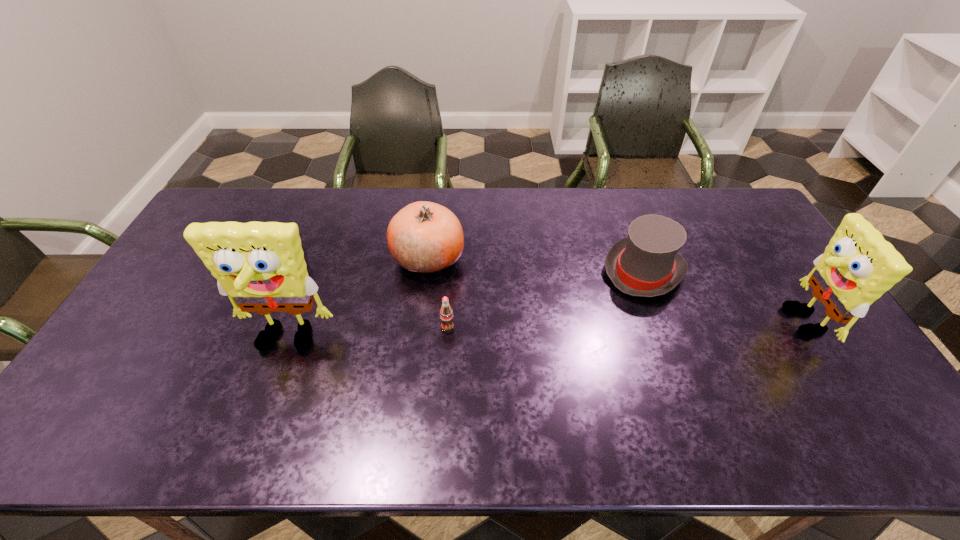
Image resolution: width=960 pixels, height=540 pixels. I want to click on the taller sponge, so click(260, 266).

You are a GUI agent. You are given a task and a screenshot of the screen. Output one action in this format:
    pyautogui.click(x=<x>, y=<y>)
    Task: Click on the left sponge
    
    Given the screenshot: What is the action you would take?
    pyautogui.click(x=260, y=266)

You are a GUI agent. You are given a task and a screenshot of the screen. Output one action in this format:
    pyautogui.click(x=<x>, y=<y>)
    Task: Click on the right sponge
    
    Given the screenshot: What is the action you would take?
    pyautogui.click(x=858, y=266)

Locate an element on the screen. the rightmost object is located at coordinates (858, 266).

Identify the location of pumpkin. The image size is (960, 540). (424, 237).

Where is `the second object from right to left`? the second object from right to left is located at coordinates (645, 264).

Where is `dress hat`? dress hat is located at coordinates (645, 264).

In order to click on soda in this screenshot , I will do `click(446, 314)`.

This screenshot has height=540, width=960. Find the location of `dumbbell`. dumbbell is located at coordinates tap(304, 250).

Identify the location of free space located 0.090m on the face of the left sponge. (267, 393).